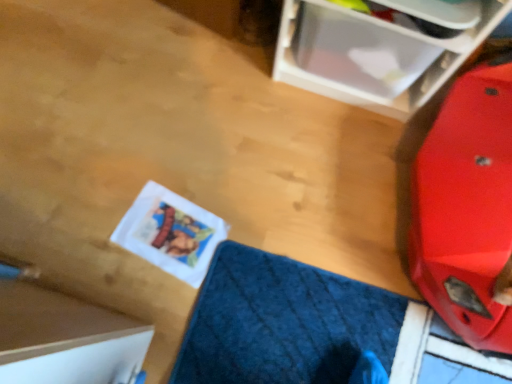
You are a GUI agent. You are given a task and a screenshot of the screen. Output one action in this format:
    pyautogui.click(x=<x>, y=<y>)
    Task: Click on the free space that is to the left of transparent plastic drawer at upper right
    
    Given the screenshot: What is the action you would take?
    pyautogui.click(x=226, y=77)